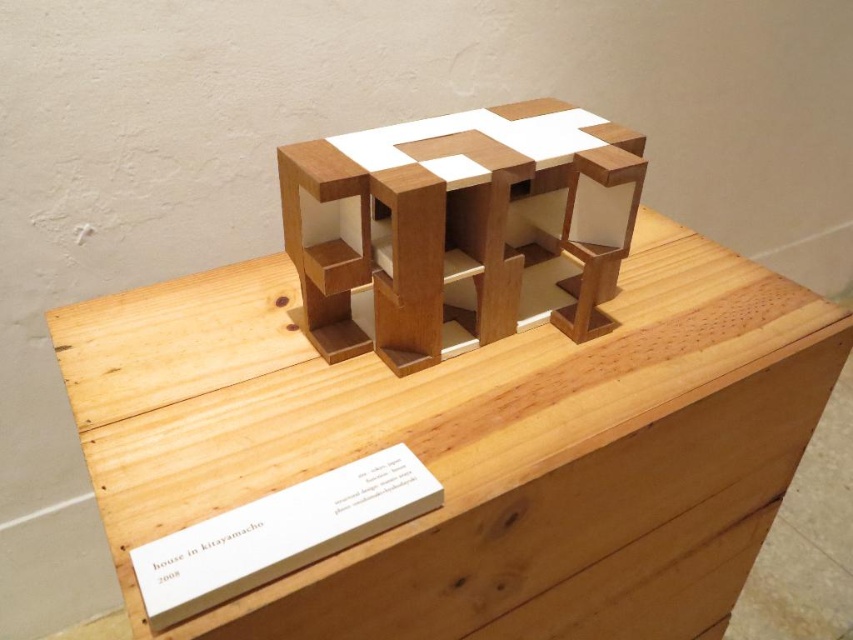
Question: Which object appears closest to the camera in this image?

Choices:
 (A) natural wood model at center
 (B) white paper at center

Answer: (B)

Question: Is natural wood model at center smaller than white paper at center?

Choices:
 (A) no
 (B) yes

Answer: (A)

Question: Is natural wood model at center smaller than white paper at center?

Choices:
 (A) yes
 (B) no

Answer: (B)

Question: Does natural wood model at center have a larger size compared to white paper at center?

Choices:
 (A) yes
 (B) no

Answer: (A)

Question: Which object is farther from the camera taking this photo?

Choices:
 (A) white paper at center
 (B) natural wood model at center

Answer: (B)